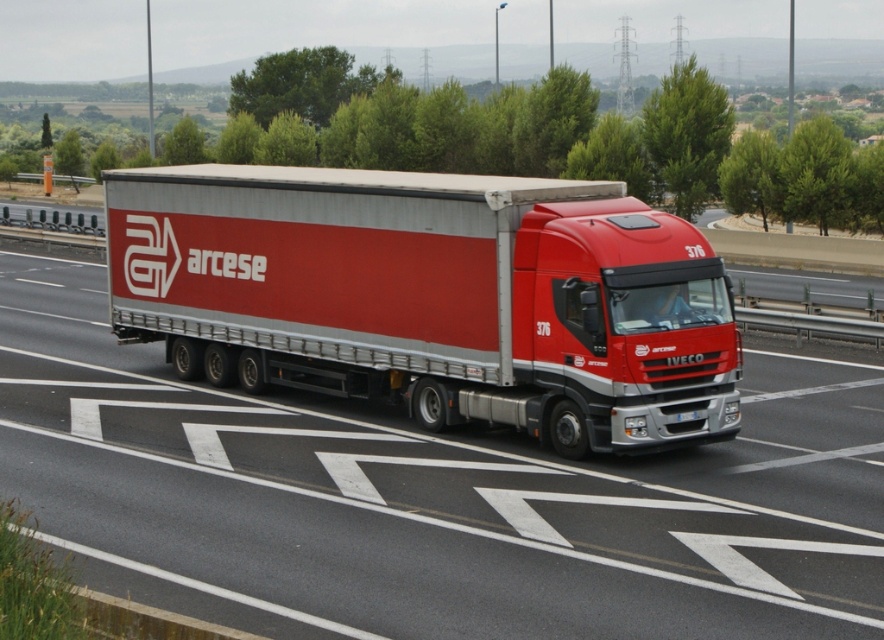
Question: Which point is farther to the camera?

Choices:
 (A) white plastic license plate at center
 (B) red matte truck at center

Answer: (A)

Question: Can you confirm if metallic silver trailer at center is positioned to the left of white plastic license plate at center?

Choices:
 (A) yes
 (B) no

Answer: (A)

Question: Can you confirm if red matte truck at center is wider than metallic silver trailer at center?

Choices:
 (A) yes
 (B) no

Answer: (A)

Question: Is the position of metallic silver trailer at center less distant than that of white plastic license plate at center?

Choices:
 (A) no
 (B) yes

Answer: (B)

Question: Among these objects, which one is farthest from the camera?

Choices:
 (A) white plastic license plate at center
 (B) red matte truck at center
 (C) metallic silver trailer at center

Answer: (A)

Question: Which of the following is the closest to the observer?

Choices:
 (A) (672, 358)
 (B) (263, 314)

Answer: (A)